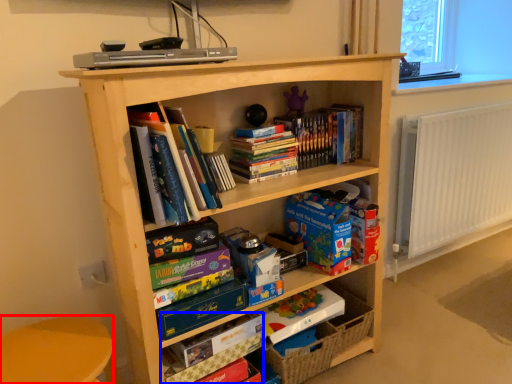
Question: Which point is further to the camera, armchair (highlighted by a red box) or paperback book (highlighted by a blue box)?

Choices:
 (A) armchair
 (B) paperback book

Answer: (B)